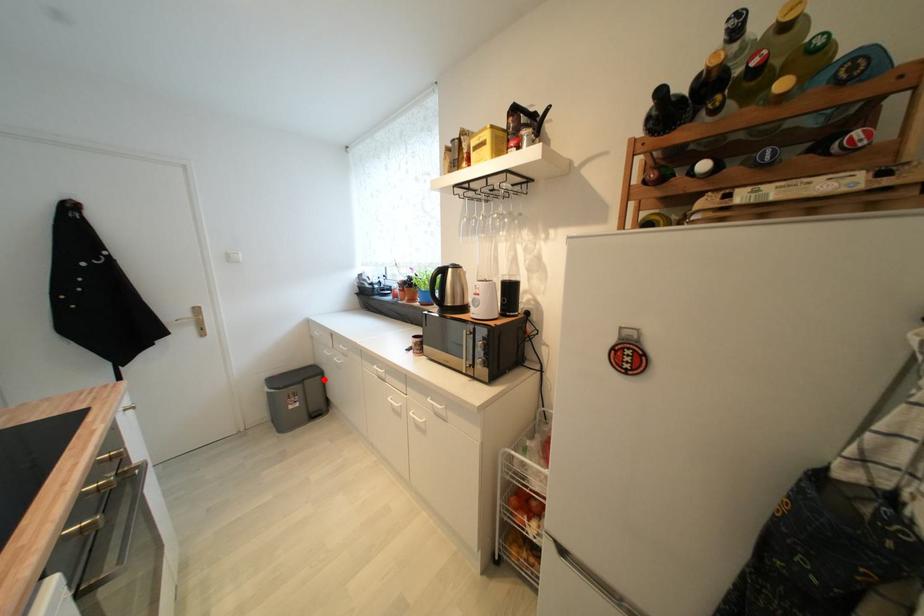
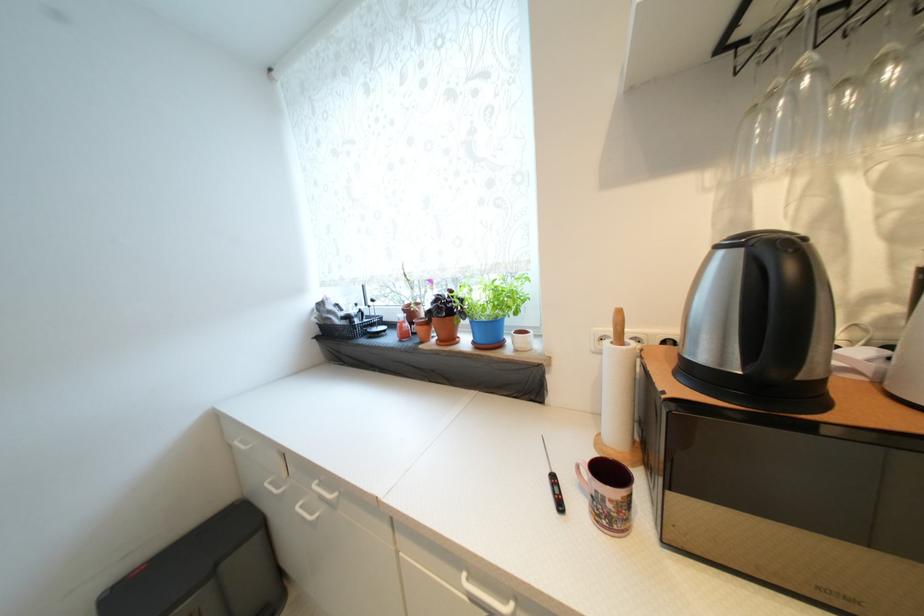
Locate, in the second image, the point that corresponds to the highlighted location in the first image.

(261, 541)